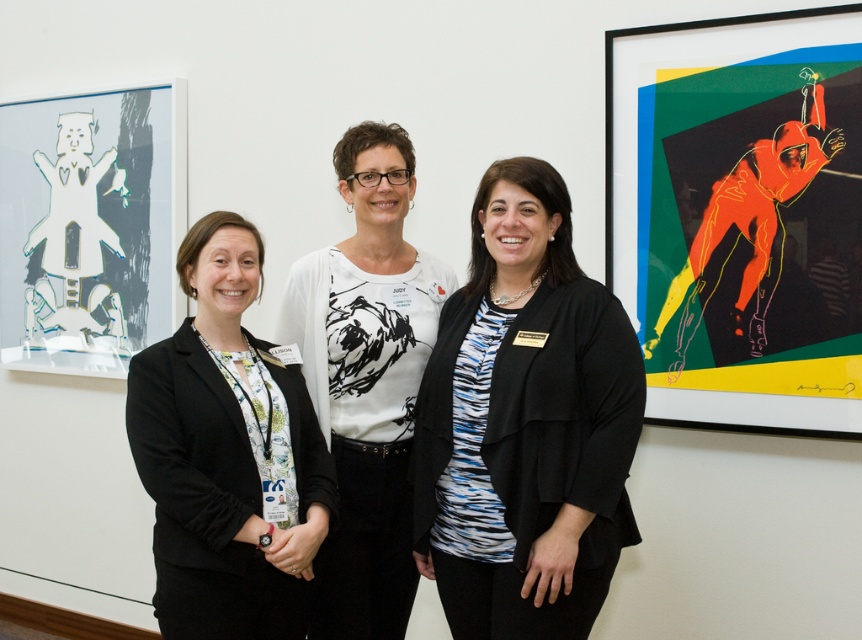
Looking at this image, who is taller, black textured blazer at center or black matte blazer at left?

black textured blazer at center is taller.

Between black textured blazer at center and black matte blazer at left, which one is positioned higher?

Positioned higher is black textured blazer at center.

Where is `black textured blazer at center`? black textured blazer at center is located at coordinates (525, 424).